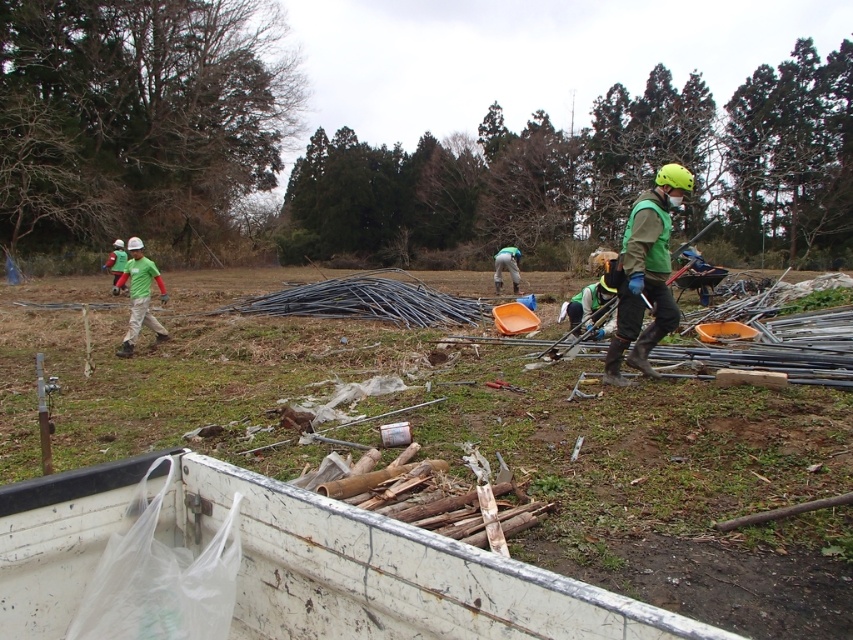
Question: Does green fabric worker at center come behind green matte shirt at left?

Choices:
 (A) no
 (B) yes

Answer: (A)

Question: Which point is closer to the camera?

Choices:
 (A) (107, 268)
 (B) (517, 259)
 (C) (135, 266)
 (D) (747, 456)

Answer: (D)

Question: Which object is closer to the camera taking this photo?

Choices:
 (A) smooth metal rods at center
 (B) green fabric shirt at left
 (C) green matte vest at center-right
 (D) green fabric worker at center

Answer: (A)

Question: Can you confirm if smooth metal rods at center is thinner than green matte shirt at left?

Choices:
 (A) no
 (B) yes

Answer: (A)

Question: Among these points, which one is farthest from the camera?

Choices:
 (A) (643, 282)
 (B) (131, 349)
 (C) (518, 250)
 (D) (108, 259)

Answer: (C)

Question: Can you confirm if green fabric shirt at left is bigger than green matte shirt at left?

Choices:
 (A) no
 (B) yes

Answer: (B)